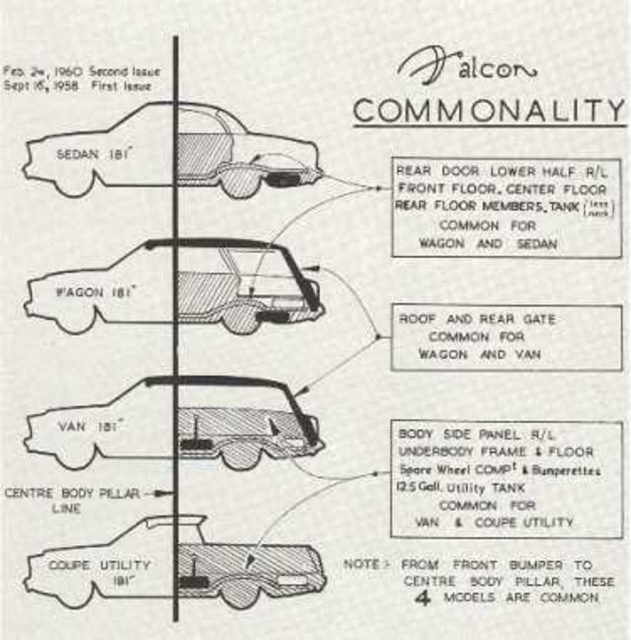
You are examining a technical diagram of Falcon vehicle models. The diagram has a left section with four models and a right section with shared components. You notice the matte black wagon at center. Where is it positioned relative to the other models on the left side?

The matte black wagon at center is located at point (x=242, y=284), which places it centrally among the four models listed on the left side of the diagram.

You are examining a technical diagram of vehicle models. The diagram shows a matte black van at center and a matte black coupe utility at lower center. Based on their positions in the diagram, which vehicle model is placed higher?

The matte black van at center is positioned above the matte black coupe utility at lower center in the diagram.

You are an automotive designer reviewing the Falcon technical diagram. You notice the matte black wagon at center and the matte black van at center. Which of these two models has a narrower body width according to the diagram?

The matte black wagon at center has a lesser width compared to the matte black van at center, so it is narrower.